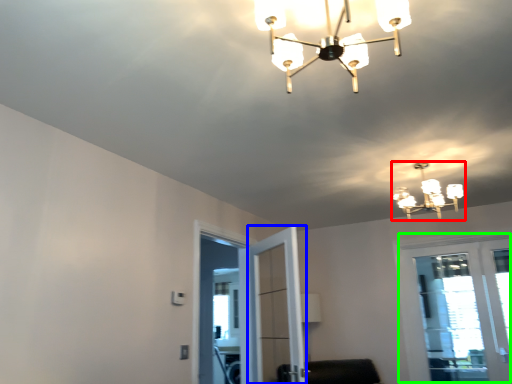
Question: Considering the real-world distances, which object is closest to lamp (highlighted by a red box)? screen door (highlighted by a blue box) or window (highlighted by a green box).

Choices:
 (A) screen door
 (B) window

Answer: (B)